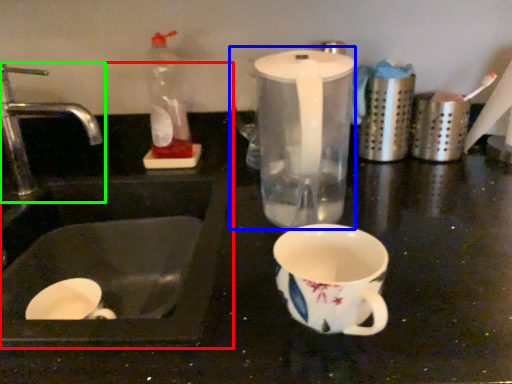
Question: Which object is positioned farthest from sink (highlighted by a red box)? Select from blender (highlighted by a blue box) and tap (highlighted by a green box).

Choices:
 (A) blender
 (B) tap

Answer: (A)